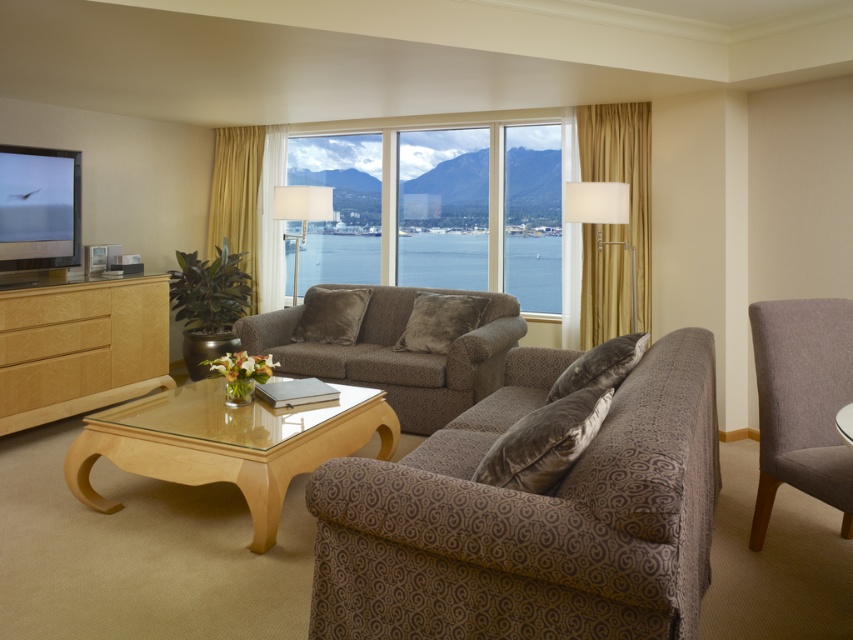
You are standing in the living room and want to place a 6.5 feet long sofa. The sofa must be placed such that its center aligns with the point at coordinates point (422,464). Is there enough space in the living room to accommodate the sofa without it extending beyond the room boundaries?

The distance from the viewer to point (422,464) is 8.46 feet. Since the sofa is 6.5 feet long, there should be sufficient space as long as the sofa is placed centrally at that point without exceeding the room boundaries. However, the exact placement depends on the room dimensions not specified here.

From the picture: You are standing in the living room and want to watch TV without moving. Can you comfortably watch the TV from the patterned fabric couch at center?

The patterned fabric couch at center and viewer are 1.50 meters apart, so yes, you can comfortably watch the TV from the patterned fabric couch at center since the distance is suitable for viewing.

You are planning to rearrange the living room and want to place a new side table next to the patterned fabric couch at center. The side table is the same size as the birch wood drawer at lower left. Will the side table fit next to the couch without overcrowding the space?

The patterned fabric couch at center is larger in size than the birch wood drawer at lower left. Since the side table is the same size as the birch wood drawer at lower left, it should fit next to the couch without overcrowding the space, as the couch is bigger and likely has enough surrounding area.